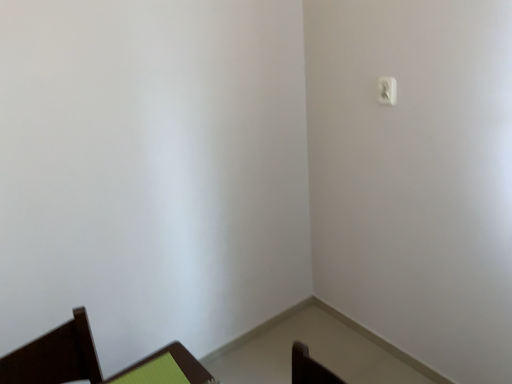
Question: Relative to green fabric chair at lower left, is white plastic light switch at upper right in front or behind?

Choices:
 (A) front
 (B) behind

Answer: (B)

Question: Is white plastic light switch at upper right taller or shorter than green fabric chair at lower left?

Choices:
 (A) short
 (B) tall

Answer: (B)

Question: From the image's perspective, is white plastic light switch at upper right located above or below green fabric chair at lower left?

Choices:
 (A) below
 (B) above

Answer: (B)

Question: Is green fabric chair at lower left bigger or smaller than white plastic light switch at upper right?

Choices:
 (A) small
 (B) big

Answer: (B)

Question: Considering the positions of green fabric chair at lower left and white plastic light switch at upper right in the image, is green fabric chair at lower left wider or thinner than white plastic light switch at upper right?

Choices:
 (A) wide
 (B) thin

Answer: (A)

Question: In terms of height, does green fabric chair at lower left look taller or shorter compared to white plastic light switch at upper right?

Choices:
 (A) short
 (B) tall

Answer: (A)

Question: From a real-world perspective, is green fabric chair at lower left physically located above or below white plastic light switch at upper right?

Choices:
 (A) above
 (B) below

Answer: (B)